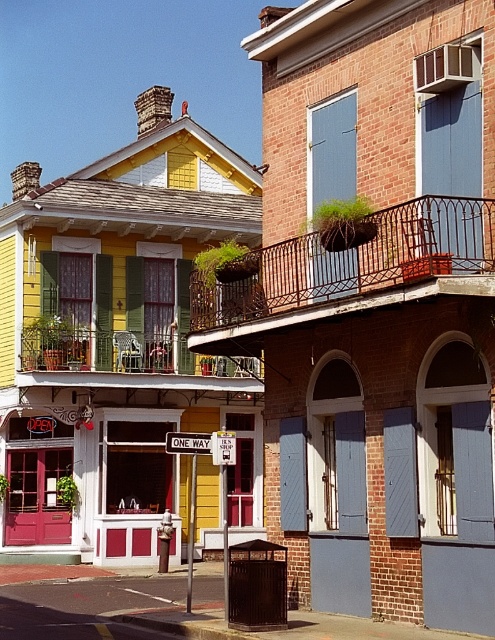
You are a painter who needs to reach both the blue painted wood at center and the gray wood shutter at center with a ladder. The ladder you have can extend to 5 meters. Can you safely reach both objects with the ladder without moving it?

The blue painted wood at center and gray wood shutter at center are 5.42 meters apart from each other. Since the ladder can only extend to 5 meters, it is not long enough to safely reach both objects without moving it.